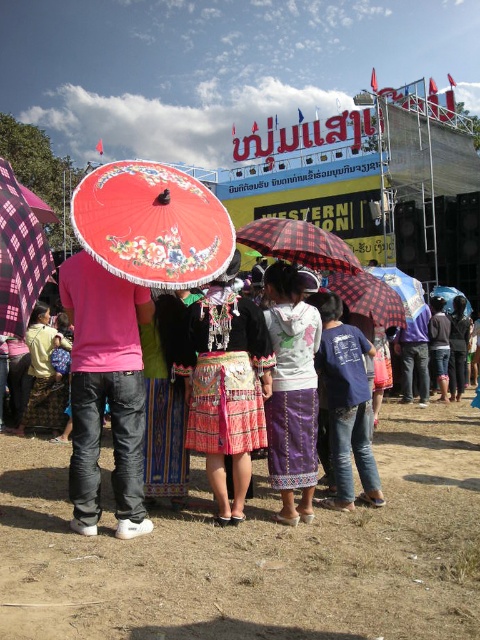
Can you confirm if matte pink parasol at center is shorter than red plaid umbrella at center?

Incorrect, matte pink parasol at center's height does not fall short of red plaid umbrella at center's.

Does point (33, 221) come farther from viewer compared to point (349, 259)?

No, (33, 221) is in front of (349, 259).

What are the coordinates of `matte pink parasol at center` in the screenshot? It's located at (20, 256).

Can you confirm if purple satin skirt at center is positioned to the right of blue cotton shirt at center?

Incorrect, purple satin skirt at center is not on the right side of blue cotton shirt at center.

Can you confirm if purple satin skirt at center is positioned to the left of blue cotton shirt at center?

Yes, purple satin skirt at center is to the left of blue cotton shirt at center.

Identify the location of purple satin skirt at center. The height and width of the screenshot is (640, 480). (291, 392).

Between point (9, 166) and point (468, 314), which one is positioned in front?

Point (9, 166)

Which of these two, matte pink parasol at center or matte black umbrella at center, stands shorter?

matte black umbrella at center is shorter.

Is point (26, 234) positioned in front of point (452, 310)?

Yes, point (26, 234) is in front of point (452, 310).

Where is `matte pink parasol at center`? This screenshot has height=640, width=480. matte pink parasol at center is located at coordinates (20, 256).